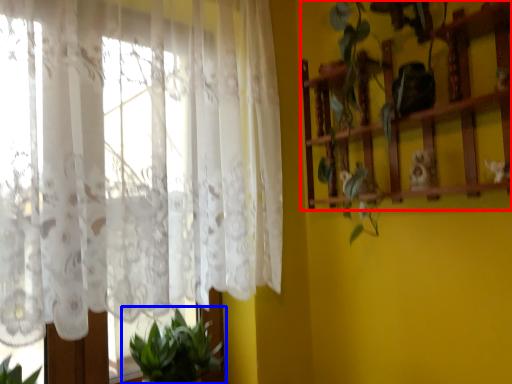
Question: Which object is further to the camera taking this photo, shelf (highlighted by a red box) or houseplant (highlighted by a blue box)?

Choices:
 (A) shelf
 (B) houseplant

Answer: (B)